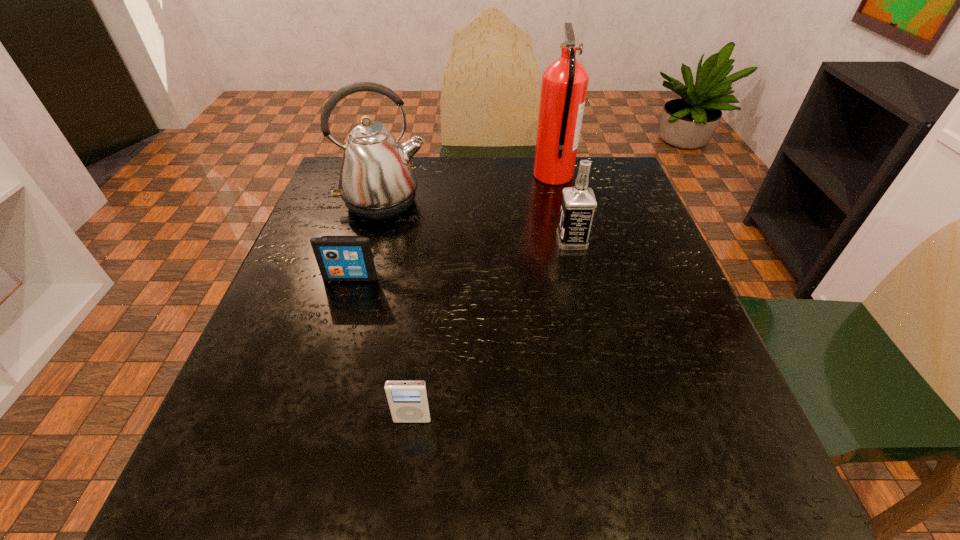
Where is `free spot between the left iPod and the nearer iPod`? This screenshot has height=540, width=960. free spot between the left iPod and the nearer iPod is located at coordinates (381, 348).

Find the location of a particular element. free space between the third tallest object and the fourth farthest object is located at coordinates (461, 259).

Image resolution: width=960 pixels, height=540 pixels. I want to click on free spot between the fire extinguisher and the nearer iPod, so click(x=483, y=298).

Locate an element on the screen. The width and height of the screenshot is (960, 540). vacant region between the third tallest object and the kettle is located at coordinates (478, 222).

Find the location of a particular element. The width and height of the screenshot is (960, 540). unoccupied position between the second tallest object and the fire extinguisher is located at coordinates (468, 190).

The image size is (960, 540). I want to click on free point between the fire extinguisher and the fourth farthest object, so click(x=452, y=227).

Locate an element on the screen. The image size is (960, 540). free space between the fourth farthest object and the vodka is located at coordinates (461, 259).

Find the location of a particular element. free space that is in between the left iPod and the third nearest object is located at coordinates (461, 259).

The image size is (960, 540). In order to click on vacant region between the farther iPod and the nearest object in this screenshot , I will do pyautogui.click(x=381, y=348).

Point out which object is positioned as the fourth nearest to the fourth shortest object. Please provide its 2D coordinates. Your answer should be formatted as a tuple, i.e. [(x, y)], where the tuple contains the x and y coordinates of a point satisfying the conditions above.

[(408, 401)]